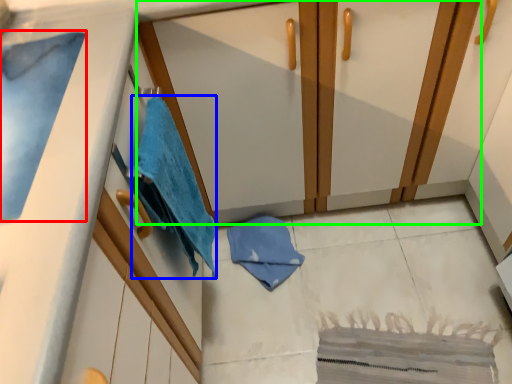
Question: Considering the real-world distances, which object is closest to bath towel (highlighted by a red box)? beach towel (highlighted by a blue box) or dresser (highlighted by a green box).

Choices:
 (A) beach towel
 (B) dresser

Answer: (A)